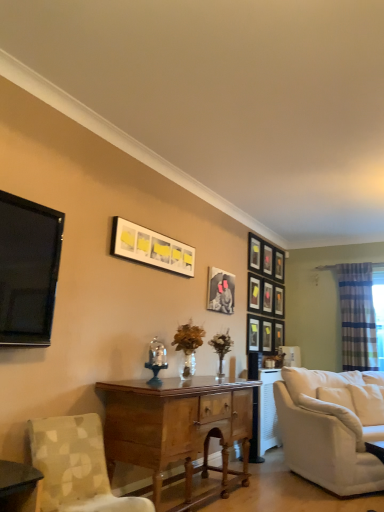
Question: Is matte black picture frame at center, placed as the 10th picture frame when sorted from right to left, positioned beyond the bounds of matte black picture frame at upper right, which appears as the fifth picture frame when viewed from the left?

Choices:
 (A) yes
 (B) no

Answer: (A)

Question: Can you confirm if matte black picture frame at center, the 2th picture frame positioned from the left, is positioned to the left of matte black picture frame at upper right, which appears as the fifth picture frame when viewed from the left?

Choices:
 (A) yes
 (B) no

Answer: (A)

Question: Considering the relative sizes of matte black picture frame at center, placed as the 10th picture frame when sorted from right to left, and matte black picture frame at upper right, which is counted as the 7th picture frame, starting from the right, in the image provided, is matte black picture frame at center, placed as the 10th picture frame when sorted from right to left, smaller than matte black picture frame at upper right, which is counted as the 7th picture frame, starting from the right,?

Choices:
 (A) no
 (B) yes

Answer: (A)

Question: From a real-world perspective, does matte black picture frame at center, the 2th picture frame positioned from the left, sit lower than matte black picture frame at upper right, which is counted as the 7th picture frame, starting from the right?

Choices:
 (A) yes
 (B) no

Answer: (A)

Question: Can you confirm if matte black picture frame at center, the 2th picture frame positioned from the left, is wider than matte black picture frame at upper right, which appears as the fifth picture frame when viewed from the left?

Choices:
 (A) no
 (B) yes

Answer: (A)

Question: Do you think matte black picture frame at upper center, which appears as the 11th picture frame when viewed from the left, is within patterned fabric chair at lower left, or outside of it?

Choices:
 (A) inside
 (B) outside

Answer: (B)

Question: Visually, is matte black picture frame at upper center, which is the 1th picture frame from right to left, positioned to the left or to the right of patterned fabric chair at lower left?

Choices:
 (A) left
 (B) right

Answer: (B)

Question: From the image's perspective, relative to patterned fabric chair at lower left, is matte black picture frame at upper center, which appears as the 11th picture frame when viewed from the left, above or below?

Choices:
 (A) above
 (B) below

Answer: (A)

Question: Considering the positions of matte black picture frame at upper center, which appears as the 11th picture frame when viewed from the left, and patterned fabric chair at lower left in the image, is matte black picture frame at upper center, which appears as the 11th picture frame when viewed from the left, taller or shorter than patterned fabric chair at lower left?

Choices:
 (A) short
 (B) tall

Answer: (A)

Question: Considering the positions of matte black picture frame at center, the third picture frame from the left, and wooden desk at center in the image, is matte black picture frame at center, the third picture frame from the left, taller or shorter than wooden desk at center?

Choices:
 (A) tall
 (B) short

Answer: (B)

Question: Which is correct: matte black picture frame at center, the third picture frame from the left, is inside wooden desk at center, or outside of it?

Choices:
 (A) inside
 (B) outside

Answer: (B)

Question: Considering the positions of matte black picture frame at center, acting as the 9th picture frame starting from the right, and wooden desk at center in the image, is matte black picture frame at center, acting as the 9th picture frame starting from the right, wider or thinner than wooden desk at center?

Choices:
 (A) wide
 (B) thin

Answer: (B)

Question: From the image's perspective, is matte black picture frame at center, the third picture frame from the left, above or below wooden desk at center?

Choices:
 (A) below
 (B) above

Answer: (B)

Question: Is point (152, 467) positioned closer to the camera than point (281, 274)?

Choices:
 (A) farther
 (B) closer

Answer: (B)

Question: From the image's perspective, relative to matte black picture frame at upper center, which is the 1th picture frame from right to left, is wooden desk at center above or below?

Choices:
 (A) above
 (B) below

Answer: (B)